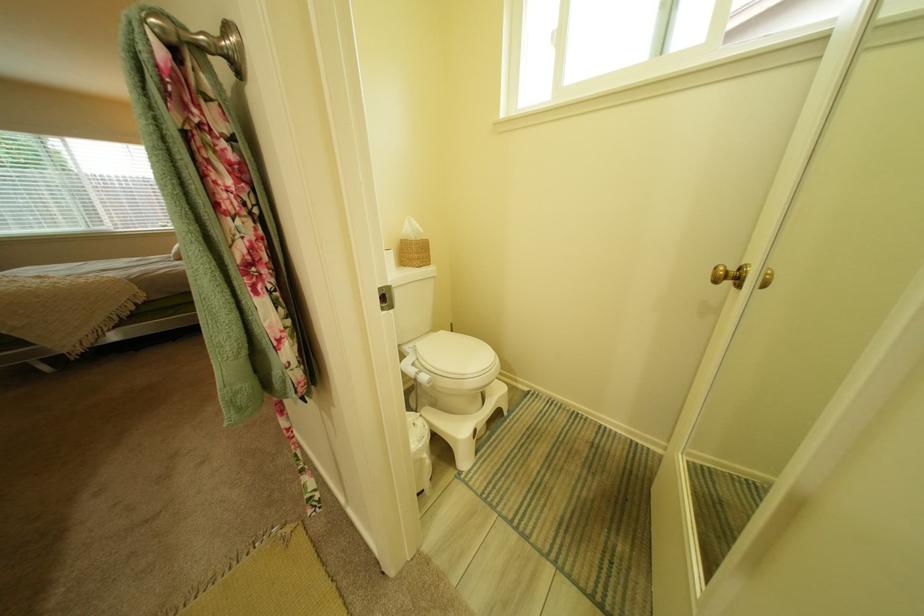
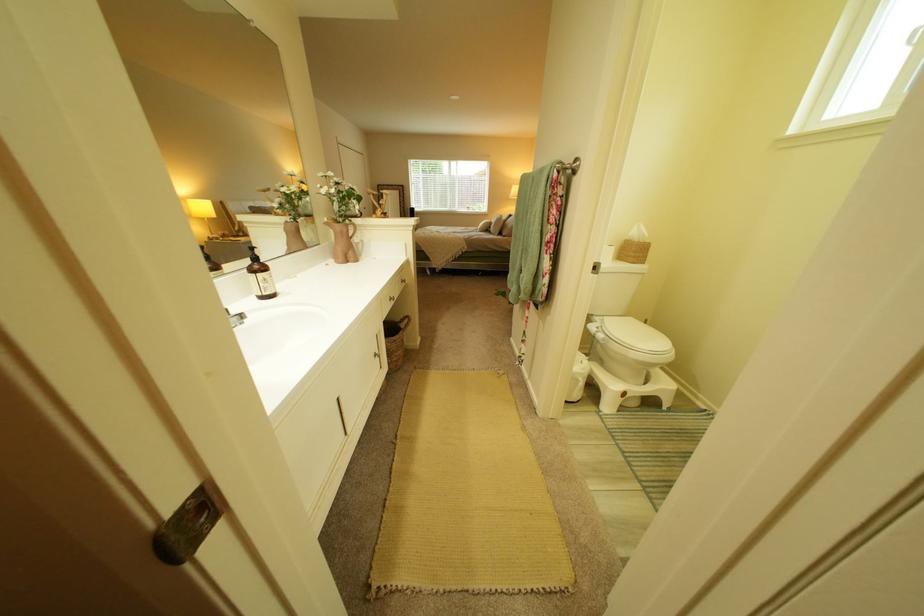
The point at (432, 363) is marked in the first image. Where is the corresponding point in the second image?

(615, 330)